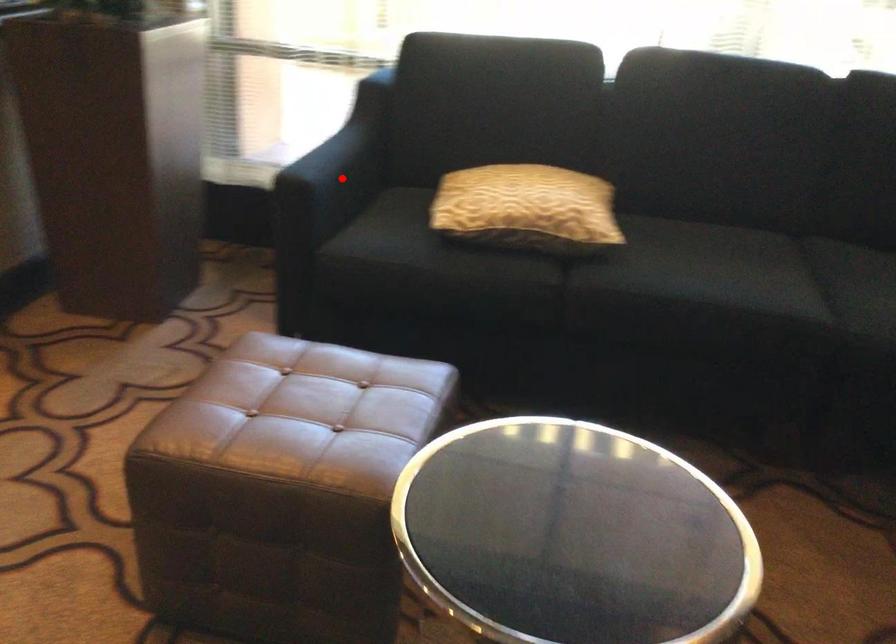
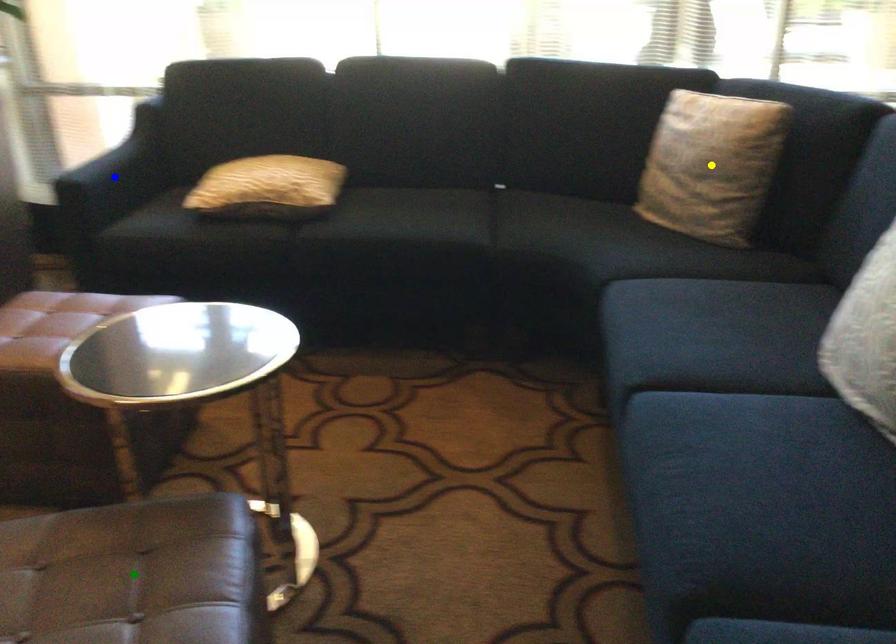
Question: I am providing you with two images of the same scene from different viewpoints. A red point is marked on the first image. You are given multiple points on the second image. Which mark in image 2 goes with the point in image 1?

Choices:
 (A) blue point
 (B) green point
 (C) yellow point

Answer: (A)